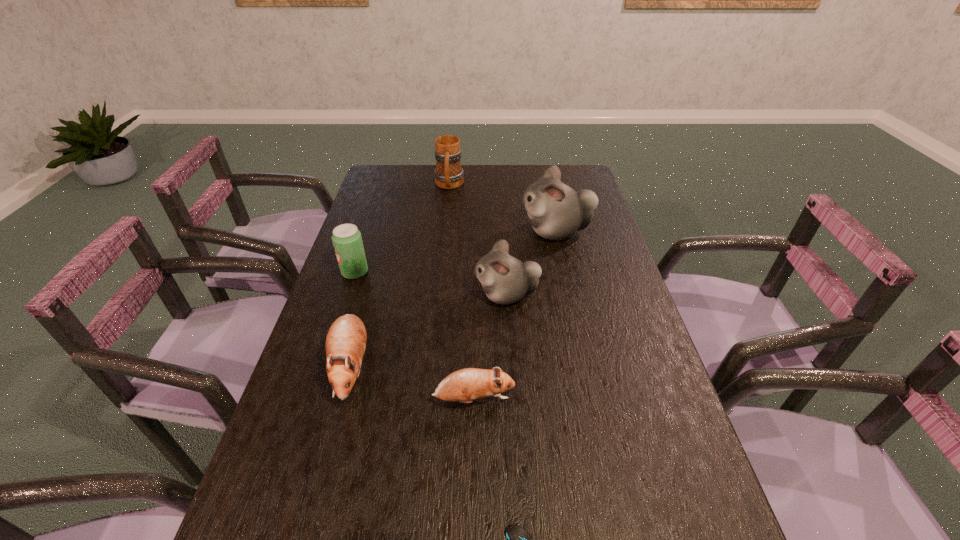
Where is `free space located on the face of the bigger white hamster`? The width and height of the screenshot is (960, 540). free space located on the face of the bigger white hamster is located at coordinates (470, 232).

Where is `free region located on the face of the bigger white hamster`? The width and height of the screenshot is (960, 540). free region located on the face of the bigger white hamster is located at coordinates (449, 232).

Image resolution: width=960 pixels, height=540 pixels. I want to click on vacant position located 0.290m on the face of the bigger white hamster, so click(x=431, y=232).

Locate an element on the screen. This screenshot has width=960, height=540. vacant area situated 0.110m on the side of the mug with the handle is located at coordinates (446, 213).

The image size is (960, 540). I want to click on vacant space located on the face of the nearer white hamster, so click(409, 295).

Where is `free space located 0.360m on the face of the nearer white hamster`? This screenshot has height=540, width=960. free space located 0.360m on the face of the nearer white hamster is located at coordinates (345, 295).

Find the location of a particular element. Image resolution: width=960 pixels, height=540 pixels. vacant space situated 0.400m on the face of the nearer white hamster is located at coordinates (330, 295).

At what (x,y) coordinates should I click in order to perform the action: click on free space located on the back of the soda. Please return your answer as a coordinate pair (x, y). The width and height of the screenshot is (960, 540). Looking at the image, I should click on (376, 208).

I want to click on blank space located at the face of the third shortest object, so click(x=323, y=472).

This screenshot has width=960, height=540. What are the coordinates of `vacant point located at the face of the right brown hamster` in the screenshot? It's located at coord(564,400).